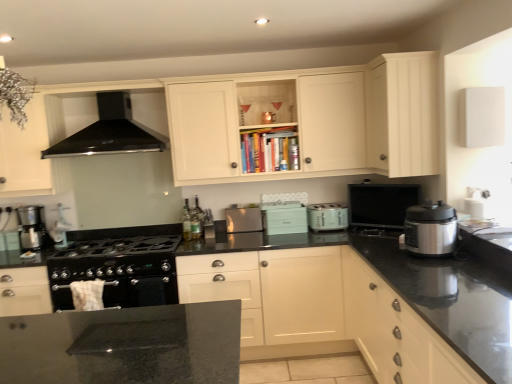
Question: Can you confirm if light teal plastic toaster at center, the 1th appliance viewed from the left, is thinner than metallic silver coffee maker at left, which is counted as the fourth kitchen appliance, starting from the right?

Choices:
 (A) no
 (B) yes

Answer: (A)

Question: Is light teal plastic toaster at center, the 1th appliance viewed from the left, facing away from metallic silver coffee maker at left, the 1th kitchen appliance in the left-to-right sequence?

Choices:
 (A) no
 (B) yes

Answer: (A)

Question: Is metallic silver coffee maker at left, which is counted as the fourth kitchen appliance, starting from the right, located within light teal plastic toaster at center, the second appliance when ordered from right to left?

Choices:
 (A) no
 (B) yes

Answer: (A)

Question: Is light teal plastic toaster at center, the 1th appliance viewed from the left, aimed at metallic silver coffee maker at left, the 1th kitchen appliance in the left-to-right sequence?

Choices:
 (A) yes
 (B) no

Answer: (B)

Question: Is there a large distance between light teal plastic toaster at center, the 1th appliance viewed from the left, and metallic silver coffee maker at left, acting as the 3th kitchen appliance starting from the back?

Choices:
 (A) no
 (B) yes

Answer: (B)

Question: Considering the positions of matte black monitor at upper right, acting as the 1th appliance starting from the right, and matte white cabinet at upper center, acting as the second cabinetry starting from the top, in the image, is matte black monitor at upper right, acting as the 1th appliance starting from the right, taller or shorter than matte white cabinet at upper center, acting as the second cabinetry starting from the top,?

Choices:
 (A) short
 (B) tall

Answer: (A)

Question: In the image, is matte black monitor at upper right, acting as the 1th appliance starting from the right, positioned in front of or behind matte white cabinet at upper center, the 3th cabinetry positioned from the bottom?

Choices:
 (A) front
 (B) behind

Answer: (B)

Question: From a real-world perspective, relative to matte white cabinet at upper center, acting as the second cabinetry starting from the top, is matte black monitor at upper right, which is counted as the second appliance, starting from the left, vertically above or below?

Choices:
 (A) above
 (B) below

Answer: (B)

Question: Is matte black monitor at upper right, acting as the 1th appliance starting from the right, wider or thinner than matte white cabinet at upper center, acting as the second cabinetry starting from the top?

Choices:
 (A) thin
 (B) wide

Answer: (A)

Question: Is point (261, 228) closer or farther from the camera than point (296, 230)?

Choices:
 (A) closer
 (B) farther

Answer: (B)

Question: Considering the relative positions of satin silver toaster at center, the first kitchen appliance positioned from the back, and light teal plastic toaster at center, the 1th appliance viewed from the left, in the image provided, is satin silver toaster at center, the first kitchen appliance positioned from the back, to the left or to the right of light teal plastic toaster at center, the 1th appliance viewed from the left,?

Choices:
 (A) right
 (B) left

Answer: (B)

Question: Considering the positions of satin silver toaster at center, the first kitchen appliance positioned from the back, and light teal plastic toaster at center, the 1th appliance viewed from the left, in the image, is satin silver toaster at center, the first kitchen appliance positioned from the back, bigger or smaller than light teal plastic toaster at center, the 1th appliance viewed from the left,?

Choices:
 (A) big
 (B) small

Answer: (B)

Question: From the image's perspective, relative to light teal plastic toaster at center, the second appliance when ordered from right to left, is satin silver toaster at center, marked as the third kitchen appliance in a right-to-left arrangement, above or below?

Choices:
 (A) below
 (B) above

Answer: (A)

Question: Based on their sizes in the image, would you say white matte cabinet at upper right, marked as the 1th cabinetry in a top-to-bottom arrangement, is bigger or smaller than matte silver toaster at center, arranged as the third kitchen appliance when viewed from the left?

Choices:
 (A) big
 (B) small

Answer: (A)

Question: Choose the correct answer: Is white matte cabinet at upper right, the fourth cabinetry when ordered from bottom to top, inside matte silver toaster at center, which ranks as the 2th kitchen appliance in right-to-left order, or outside it?

Choices:
 (A) inside
 (B) outside

Answer: (B)